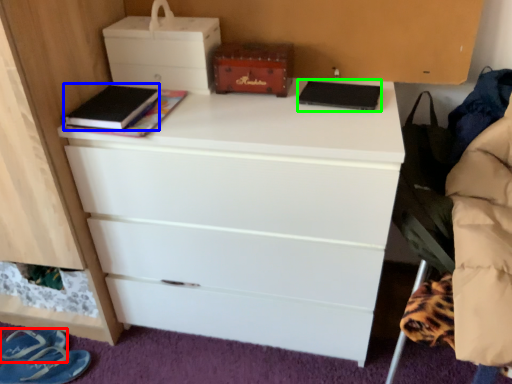
Question: Which is farther away from footwear (highlighted by a red box)? book (highlighted by a blue box) or book (highlighted by a green box)?

Choices:
 (A) book
 (B) book

Answer: (B)